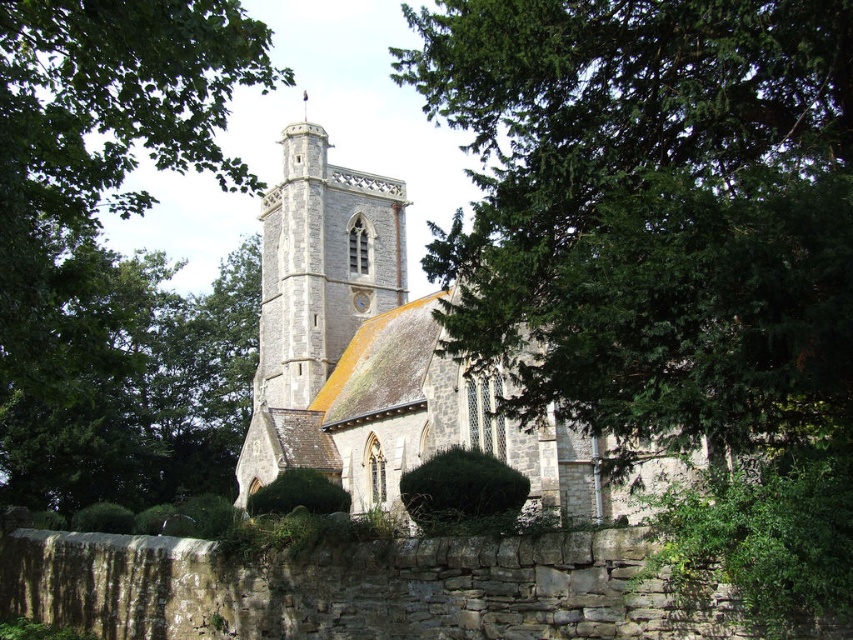
Image resolution: width=853 pixels, height=640 pixels. I want to click on stone church at center, so click(x=374, y=353).

Who is higher up, stone church at center or stone tower at center?

stone tower at center is above.

Who is more forward, (321, 340) or (366, 273)?

Positioned in front is point (321, 340).

Locate an element on the screen. stone church at center is located at coordinates (374, 353).